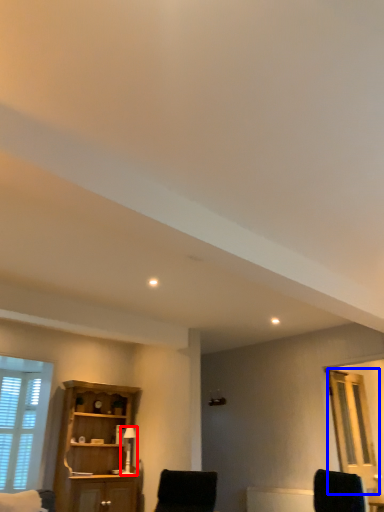
Question: Which of the following is the farthest to the observer, table lamp (highlighted by a red box) or glass door (highlighted by a blue box)?

Choices:
 (A) table lamp
 (B) glass door

Answer: (A)